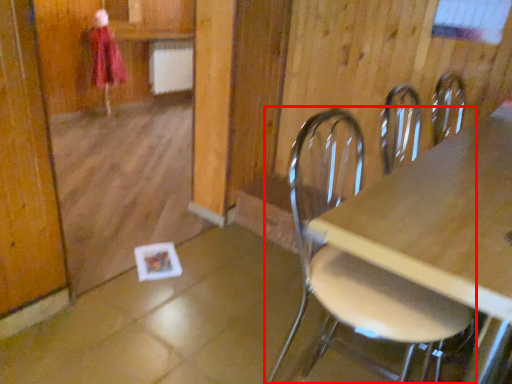
Question: From the image's perspective, considering the relative positions of chair (annotated by the red box) and person in the image provided, where is chair (annotated by the red box) located with respect to the staircase?

Choices:
 (A) below
 (B) above

Answer: (A)